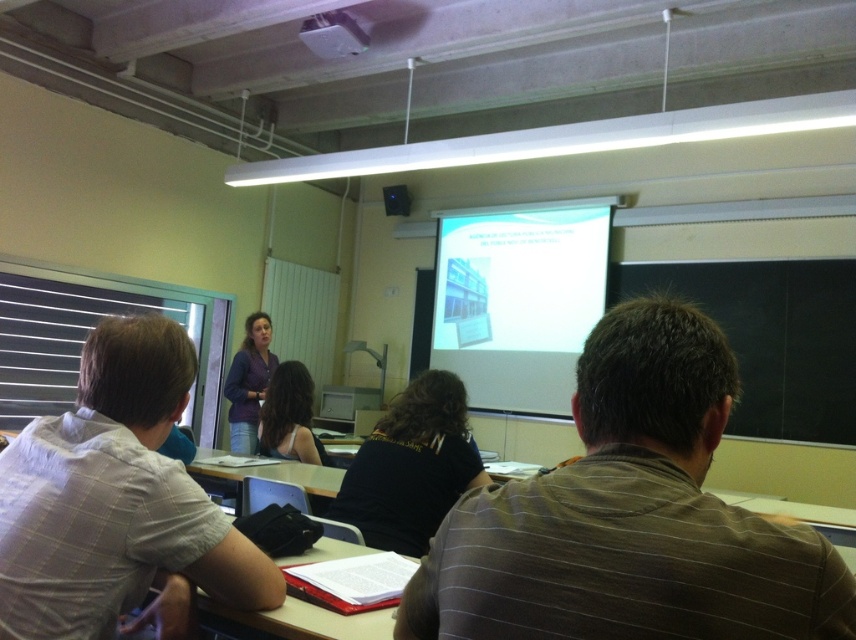
Does brown striped shirt at center come behind red plastic folder at lower center?

No, it is not.

From the picture: Who is more distant from viewer, (x=626, y=579) or (x=302, y=557)?

The point (x=302, y=557) is more distant.

What do you see at coordinates (629, 516) in the screenshot?
I see `brown striped shirt at center` at bounding box center [629, 516].

You are a GUI agent. You are given a task and a screenshot of the screen. Output one action in this format:
    pyautogui.click(x=<x>, y=<y>)
    Task: Click on the brown striped shirt at center
    This screenshot has width=856, height=640.
    Given the screenshot: What is the action you would take?
    (629, 516)

Is brown striped shirt at center above white matte projection screen at upper center?

Actually, brown striped shirt at center is below white matte projection screen at upper center.

Does brown striped shirt at center have a greater height compared to white matte projection screen at upper center?

Incorrect, brown striped shirt at center's height is not larger of white matte projection screen at upper center's.

Is point (706, 406) closer to camera compared to point (539, 237)?

Yes, point (706, 406) is in front of point (539, 237).

Locate an element on the screen. This screenshot has width=856, height=640. brown striped shirt at center is located at coordinates (629, 516).

Based on the photo, is gray striped shirt at left bigger than white plastic projector at upper center?

Yes.

Does gray striped shirt at left have a lesser height compared to white plastic projector at upper center?

No.

Is point (230, 570) farther from viewer compared to point (354, 45)?

No, it is not.

Find the location of a particular element. This screenshot has height=640, width=856. gray striped shirt at left is located at coordinates (117, 502).